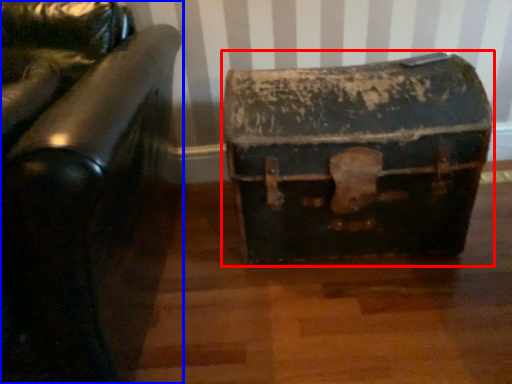
Question: Among these objects, which one is nearest to the camera, suitcase (highlighted by a red box) or furniture (highlighted by a blue box)?

Choices:
 (A) suitcase
 (B) furniture

Answer: (B)